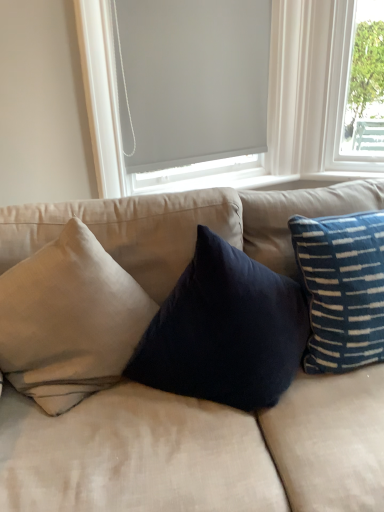
Question: In the image, is beige fabric couch at center positioned in front of or behind matte gray roller shade at upper center?

Choices:
 (A) front
 (B) behind

Answer: (A)

Question: Is beige fabric couch at center bigger or smaller than matte gray roller shade at upper center?

Choices:
 (A) big
 (B) small

Answer: (A)

Question: Estimate the real-world distances between objects in this image. Which object is farther from the gray matte window screen at upper center?

Choices:
 (A) beige cotton cushion at left, positioned as the first pillow in left-to-right order
 (B) blue striped pillow at right, which is the second pillow from left to right
 (C) matte gray roller shade at upper center
 (D) beige fabric couch at center

Answer: (D)

Question: Which is nearer to the gray matte window screen at upper center?

Choices:
 (A) matte gray roller shade at upper center
 (B) blue striped pillow at right, which is the second pillow from left to right
 (C) beige cotton cushion at left, positioned as the first pillow in left-to-right order
 (D) beige fabric couch at center

Answer: (A)